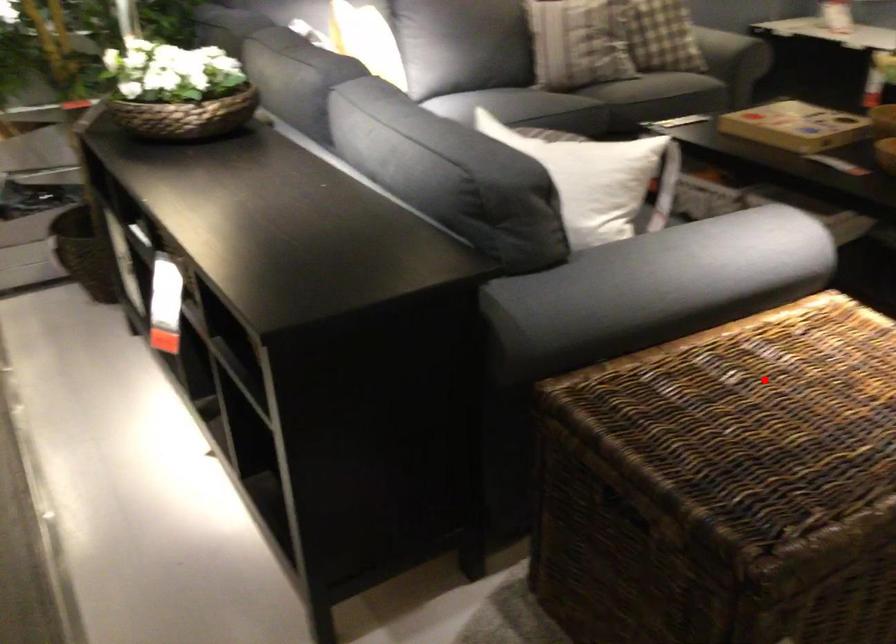
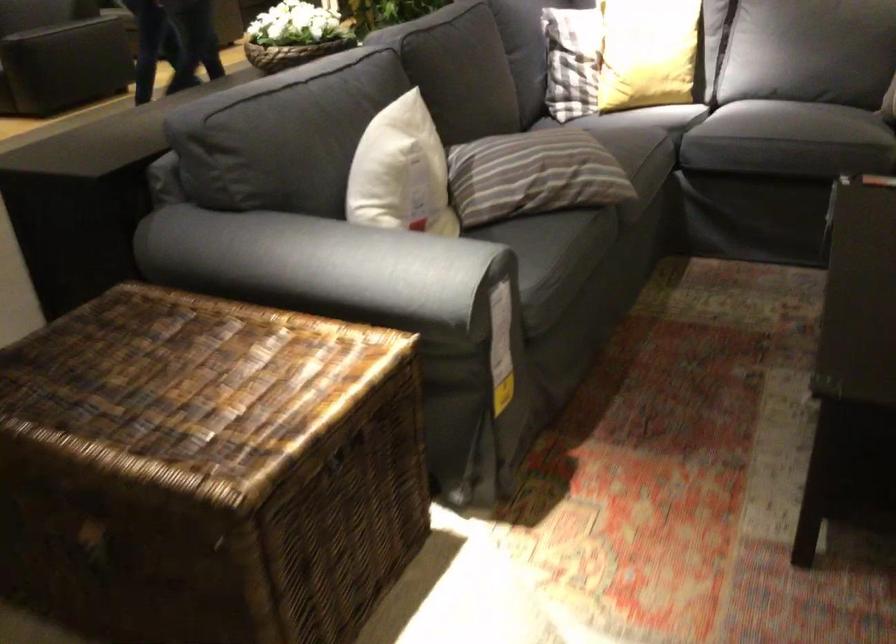
The point at the highlighted location is marked in the first image. Where is the corresponding point in the second image?

(195, 389)